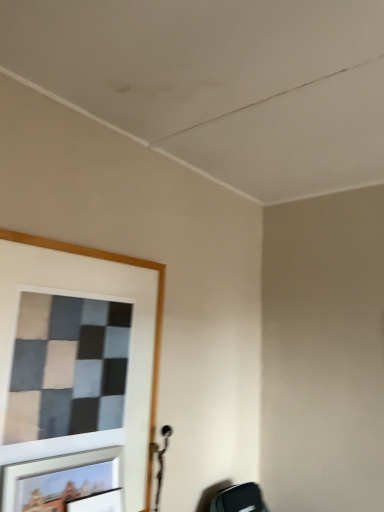
Question: Is matte black picture frame at lower left, which is counted as the 1th picture frame, starting from the bottom, completely or partially outside of metallic silver picture frame at lower left, marked as the 1th picture frame in a top-to-bottom arrangement?

Choices:
 (A) yes
 (B) no

Answer: (A)

Question: Does matte black picture frame at lower left, which is counted as the 1th picture frame, starting from the bottom, have a lesser height compared to metallic silver picture frame at lower left, marked as the 1th picture frame in a top-to-bottom arrangement?

Choices:
 (A) no
 (B) yes

Answer: (B)

Question: Does matte black picture frame at lower left, which is counted as the 1th picture frame, starting from the bottom, have a greater height compared to metallic silver picture frame at lower left, marked as the 1th picture frame in a top-to-bottom arrangement?

Choices:
 (A) yes
 (B) no

Answer: (B)

Question: From a real-world perspective, is matte black picture frame at lower left, which is counted as the 1th picture frame, starting from the bottom, positioned over metallic silver picture frame at lower left, which is the second picture frame in bottom-to-top order, based on gravity?

Choices:
 (A) no
 (B) yes

Answer: (A)

Question: Is matte black picture frame at lower left, which is the second picture frame in top-to-bottom order, to the left of metallic silver picture frame at lower left, marked as the 1th picture frame in a top-to-bottom arrangement, from the viewer's perspective?

Choices:
 (A) yes
 (B) no

Answer: (B)

Question: From the image's perspective, is matte black picture frame at lower left, which is counted as the 1th picture frame, starting from the bottom, under metallic silver picture frame at lower left, which is the second picture frame in bottom-to-top order?

Choices:
 (A) no
 (B) yes

Answer: (B)

Question: Can you confirm if metallic silver picture frame at lower left, which is the second picture frame in bottom-to-top order, is positioned to the right of matte black picture frame at lower left, which is counted as the 1th picture frame, starting from the bottom?

Choices:
 (A) yes
 (B) no

Answer: (B)

Question: Could matte black picture frame at lower left, which is the second picture frame in top-to-bottom order, be considered to be inside metallic silver picture frame at lower left, marked as the 1th picture frame in a top-to-bottom arrangement?

Choices:
 (A) no
 (B) yes

Answer: (A)

Question: Is metallic silver picture frame at lower left, marked as the 1th picture frame in a top-to-bottom arrangement, shorter than matte black picture frame at lower left, which is the second picture frame in top-to-bottom order?

Choices:
 (A) no
 (B) yes

Answer: (A)

Question: Can you confirm if metallic silver picture frame at lower left, marked as the 1th picture frame in a top-to-bottom arrangement, is taller than matte black picture frame at lower left, which is the second picture frame in top-to-bottom order?

Choices:
 (A) yes
 (B) no

Answer: (A)

Question: From the image's perspective, is metallic silver picture frame at lower left, which is the second picture frame in bottom-to-top order, located above matte black picture frame at lower left, which is the second picture frame in top-to-bottom order?

Choices:
 (A) no
 (B) yes

Answer: (B)

Question: Is metallic silver picture frame at lower left, which is the second picture frame in bottom-to-top order, smaller than matte black picture frame at lower left, which is the second picture frame in top-to-bottom order?

Choices:
 (A) no
 (B) yes

Answer: (A)

Question: Is metallic silver picture frame at lower left, which is the second picture frame in bottom-to-top order, inside or outside of matte black picture frame at lower left, which is the second picture frame in top-to-bottom order?

Choices:
 (A) inside
 (B) outside

Answer: (B)